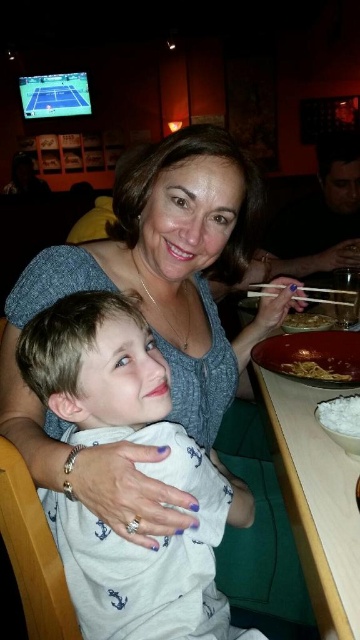
Which is more to the left, white cotton shirt at center or white fluffy rice at lower right?

white cotton shirt at center is more to the left.

What do you see at coordinates (141, 465) in the screenshot?
I see `white cotton shirt at center` at bounding box center [141, 465].

Identify the location of white cotton shirt at center. (141, 465).

Find the location of `wooden chopsticks at upper center`. wooden chopsticks at upper center is located at coordinates (263, 289).

Consider the image. Does wooden chopsticks at upper center have a greater height compared to brown matte bowl at center?

Indeed, wooden chopsticks at upper center has a greater height compared to brown matte bowl at center.

Looking at this image, who is more distant from viewer, (246, 292) or (327, 321)?

Point (246, 292)

In order to click on wooden chopsticks at upper center in this screenshot , I will do `click(263, 289)`.

Does point (357, 404) come closer to viewer compared to point (316, 378)?

Yes, it is in front of point (316, 378).

Is white fluffy rice at lower right thinner than yellow matte noodles at center?

Correct, white fluffy rice at lower right's width is less than yellow matte noodles at center's.

Does point (339, 400) come in front of point (295, 362)?

Yes, point (339, 400) is closer to viewer.

Find the location of a particular element. This screenshot has height=640, width=360. white fluffy rice at lower right is located at coordinates (339, 413).